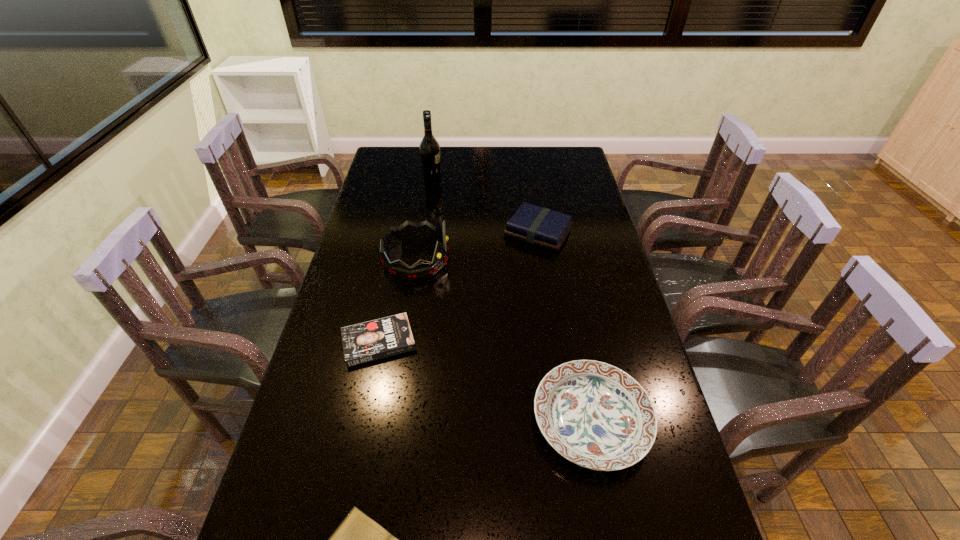
In order to click on vacant space at the right edge of the desktop in this screenshot , I will do `click(602, 298)`.

Find the location of a particular element. The width and height of the screenshot is (960, 540). blank region between the second tallest book and the farthest book is located at coordinates (459, 287).

Where is `free space between the tiara and the rightmost book`? free space between the tiara and the rightmost book is located at coordinates (477, 245).

I want to click on empty location between the farthest book and the second tallest object, so click(x=477, y=245).

The height and width of the screenshot is (540, 960). Identify the location of free space between the tiara and the second nearest object. (504, 340).

Identify the location of vacant space that's between the second nearest object and the tallest book. (564, 326).

Find the location of `free spot between the plate and the farthest object`. free spot between the plate and the farthest object is located at coordinates (512, 299).

The image size is (960, 540). Find the location of `object that is the second closest to the plate`. object that is the second closest to the plate is located at coordinates (368, 341).

The width and height of the screenshot is (960, 540). I want to click on the second closest object to the farthest object, so click(x=408, y=231).

Select which book appears as the second closest to the plate. Please provide its 2D coordinates. Your answer should be formatted as a tuple, i.e. [(x, y)], where the tuple contains the x and y coordinates of a point satisfying the conditions above.

[(368, 341)]